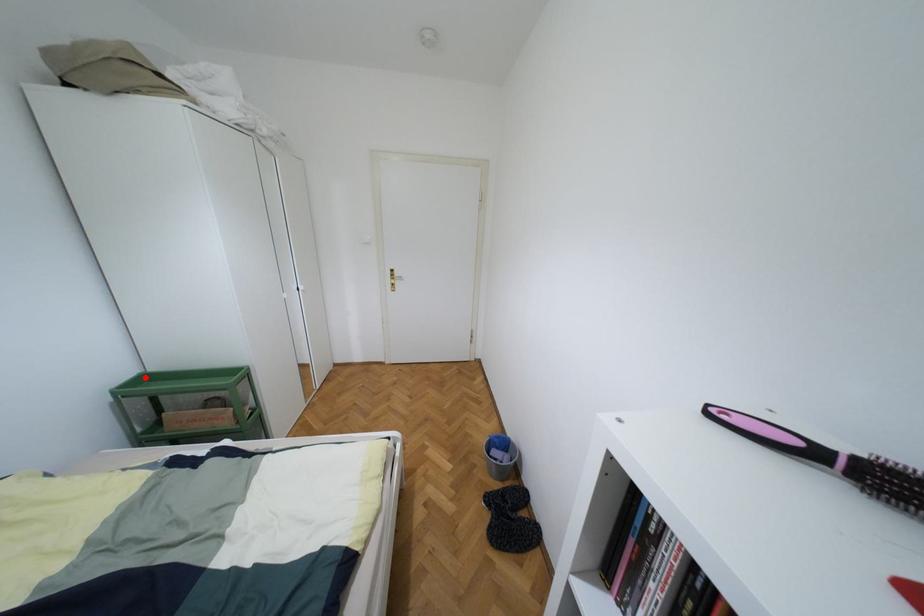
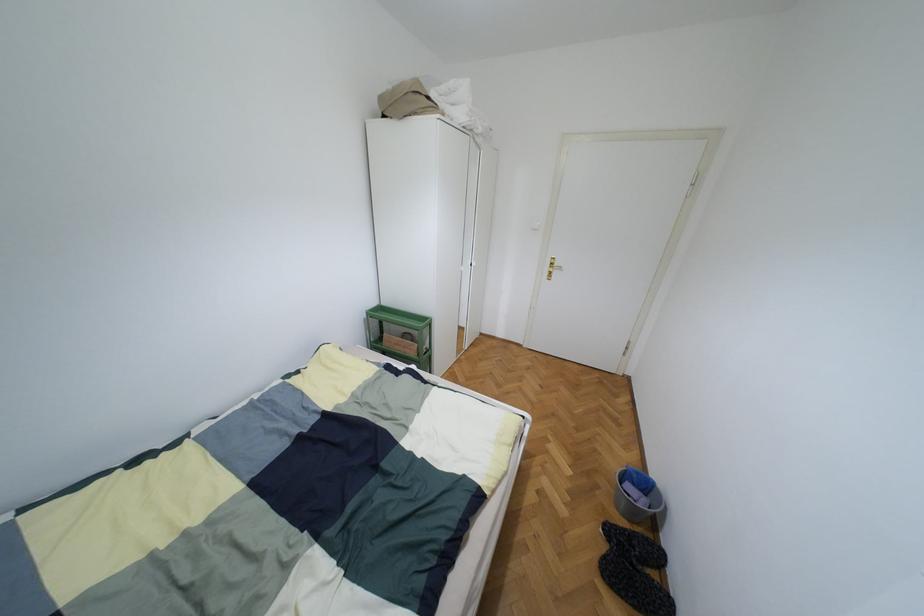
In the second image, find the point that corresponds to the highlighted location in the first image.

(380, 307)